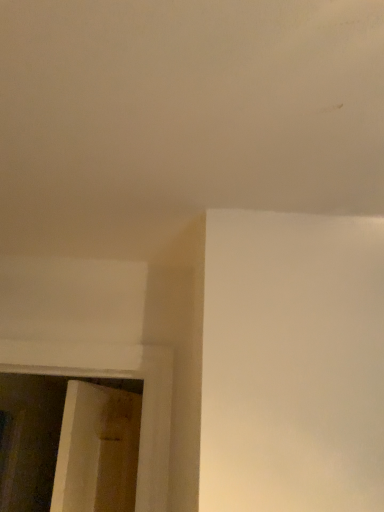
Measure the distance between white matte ceiling at upper center and camera.

The distance of white matte ceiling at upper center from camera is 19.39 inches.

This screenshot has width=384, height=512. What do you see at coordinates (192, 105) in the screenshot?
I see `white matte ceiling at upper center` at bounding box center [192, 105].

Where is `white matte ceiling at upper center`? The width and height of the screenshot is (384, 512). white matte ceiling at upper center is located at coordinates (x=192, y=105).

Identify the location of white matte ceiling at upper center. (192, 105).